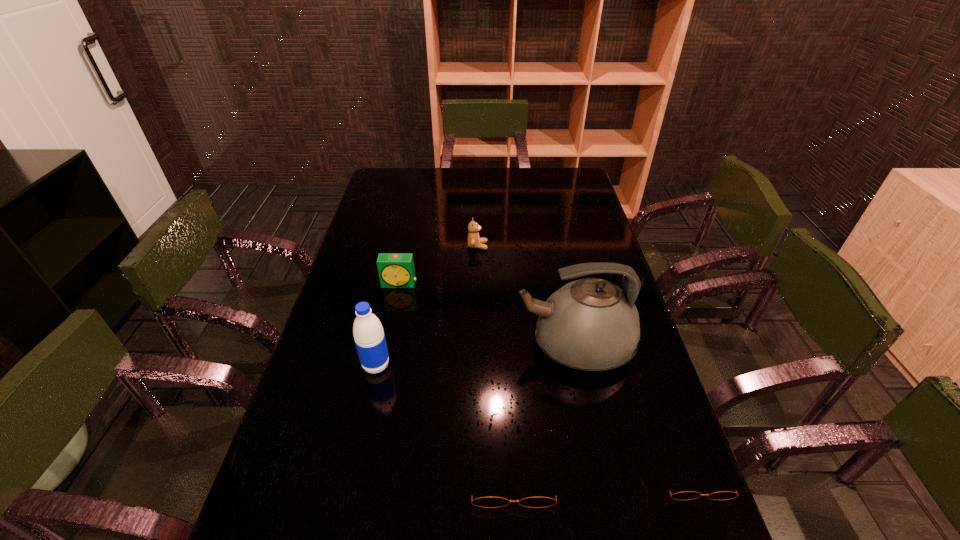
The height and width of the screenshot is (540, 960). What are the coordinates of `empty location between the fifth shortest object and the left sunglasses` in the screenshot? It's located at (444, 422).

The height and width of the screenshot is (540, 960). Find the location of `vacant area that lies between the tallest object and the water bottle`. vacant area that lies between the tallest object and the water bottle is located at coordinates (475, 355).

At what (x,y) coordinates should I click in order to perform the action: click on unoccupied position between the second tallest object and the alarm clock. Please return your answer as a coordinate pair (x, y). The image size is (960, 540). Looking at the image, I should click on (388, 325).

Locate which object is the fifth closest to the kettle. Please provide its 2D coordinates. Your answer should be formatted as a tuple, i.e. [(x, y)], where the tuple contains the x and y coordinates of a point satisfying the conditions above.

[(369, 337)]

Identify the location of object that stands as the third closest to the right sunglasses. (369, 337).

Locate an element on the screen. vacant space that satisfies the following two spatial constraints: 1. at the spout of the tallest object; 2. on the face of the taller sunglasses is located at coordinates (602, 478).